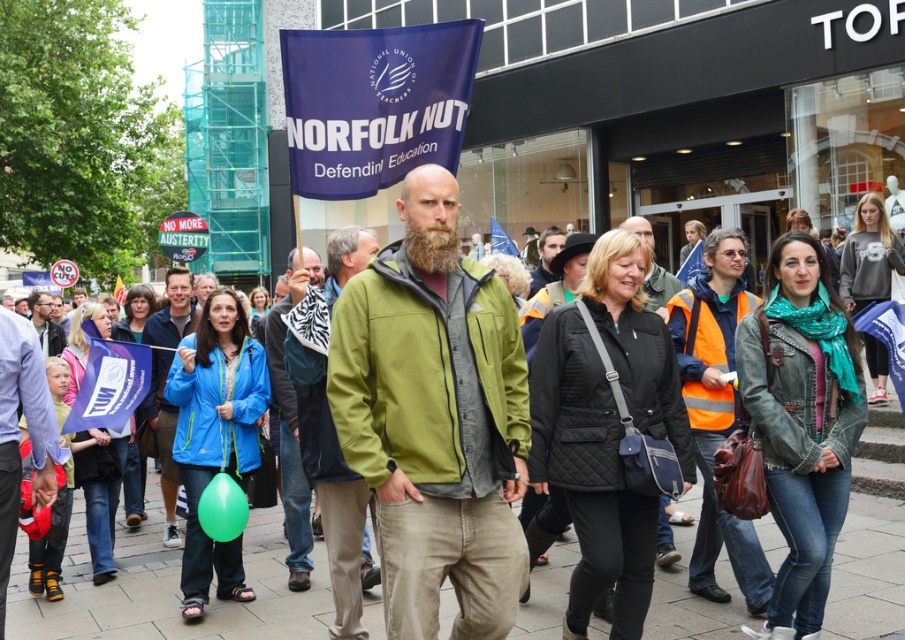
You are a photographer trying to capture a clear shot of the bearded man at center and the green matte jacket at center. Based on their sizes, which one should you focus on first to ensure it fits within your camera frame?

The green matte jacket at center has a greater height compared to the bearded man at center, so you should focus on capturing the green matte jacket at center first to ensure it fits within your camera frame.

You are standing at the point marked as point [13,630] in the image. You want to walk to the nearest exit, which is located 20 feet away from you. Is the exit within your walking distance?

The distance between point [13,630] and the viewer is 18.77 feet. Since the exit is 20 feet away from you, the exit is within your walking distance.

Based on the scene description, you are a photographer trying to capture a clear shot of both the dark brown fuzzy beard at center and the matte black jacket at center. Given that the beard is smaller than the jacket, which object should you focus on first to ensure both are in frame?

The dark brown fuzzy beard at center is smaller than the matte black jacket at center, so you should focus on the matte black jacket at center first to ensure it fits within the frame, then adjust to include the smaller beard.